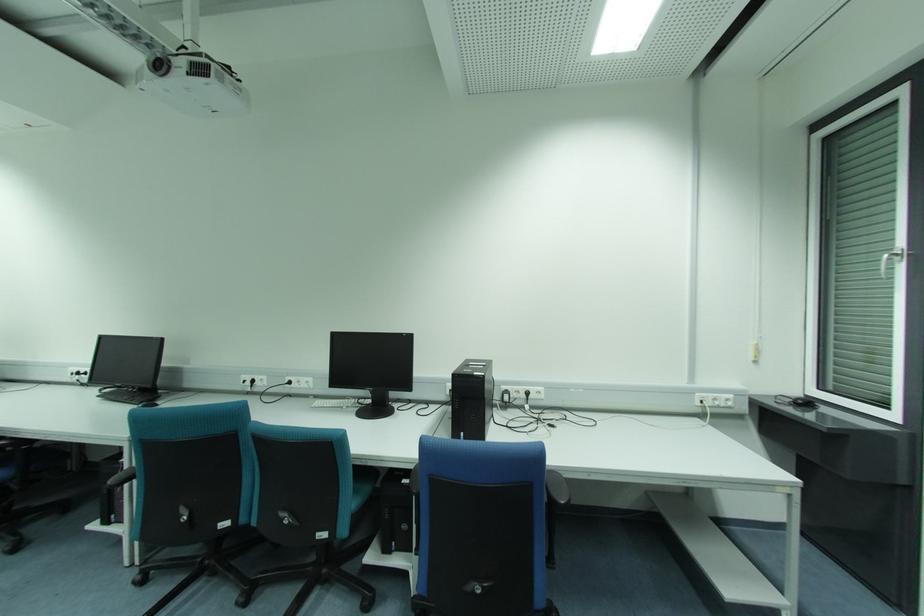
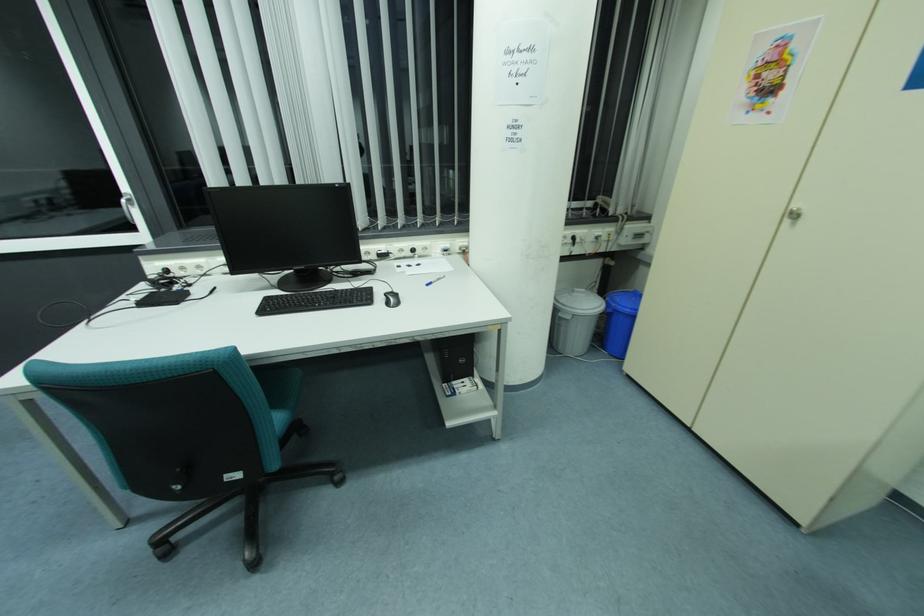
The images are taken continuously from a first-person perspective. In which direction is your viewpoint rotating?

The rotation direction of the camera is right-down.